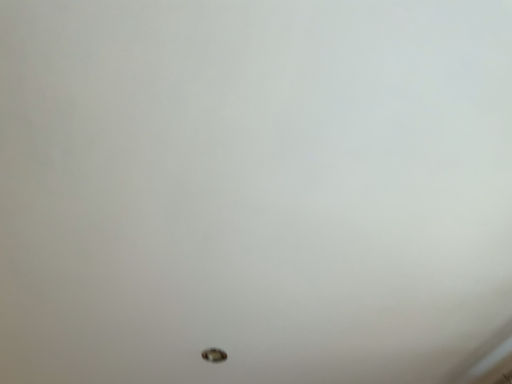
Find the location of `metallic silver ball at bottom center`. metallic silver ball at bottom center is located at coordinates (214, 355).

Describe the element at coordinates (214, 355) in the screenshot. This screenshot has width=512, height=384. I see `metallic silver ball at bottom center` at that location.

Locate an element on the screen. Image resolution: width=512 pixels, height=384 pixels. metallic silver ball at bottom center is located at coordinates (214, 355).